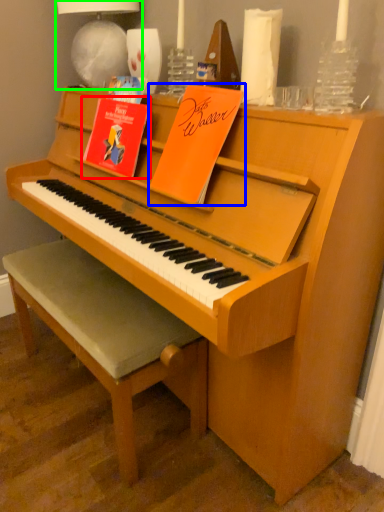
Question: Considering the real-world distances, which object is farthest from paperback book (highlighted by a red box)? paperback book (highlighted by a blue box) or lamp (highlighted by a green box)?

Choices:
 (A) paperback book
 (B) lamp

Answer: (B)